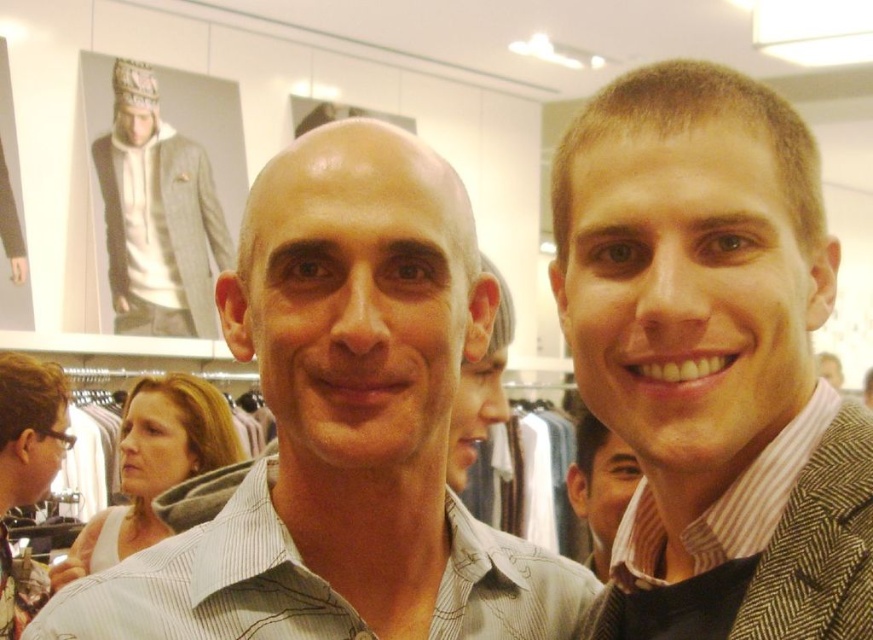
Question: Considering the real-world distances, which object is farthest from the white cotton hoodie at upper left?

Choices:
 (A) gray striped shirt at center
 (B) striped shirt at center

Answer: (B)

Question: Which is farther from the gray striped shirt at center?

Choices:
 (A) white cotton hoodie at upper left
 (B) striped shirt at center

Answer: (A)

Question: Is the position of gray striped shirt at center more distant than that of white cotton hoodie at upper left?

Choices:
 (A) yes
 (B) no

Answer: (B)

Question: Is striped shirt at center to the left of white cotton hoodie at upper left from the viewer's perspective?

Choices:
 (A) no
 (B) yes

Answer: (A)

Question: In this image, where is striped shirt at center located relative to white cotton hoodie at upper left?

Choices:
 (A) left
 (B) right

Answer: (B)

Question: Which point appears farthest from the camera in this image?

Choices:
 (A) (447, 408)
 (B) (761, 618)
 (C) (124, 67)

Answer: (C)